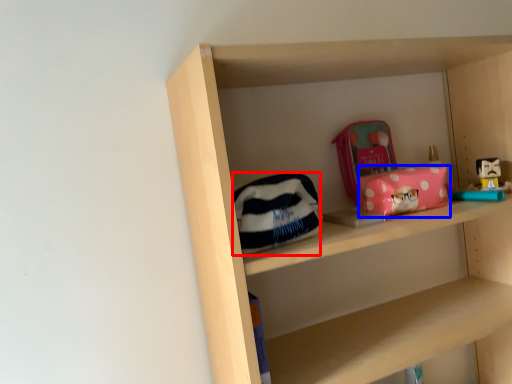
Question: Which object appears farthest to the camera in this image, pouch (highlighted by a red box) or package (highlighted by a blue box)?

Choices:
 (A) pouch
 (B) package

Answer: (B)